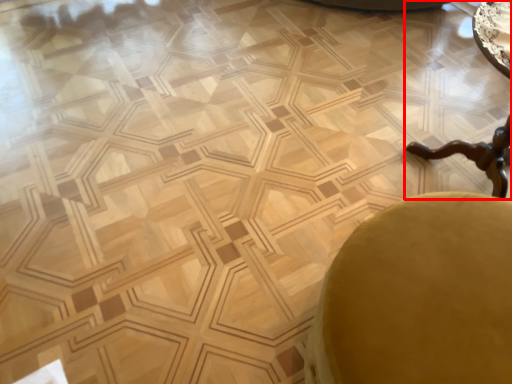
Question: From the image's perspective, where is cocktail table (annotated by the red box) located in relation to swivel chair in the image?

Choices:
 (A) below
 (B) above

Answer: (B)